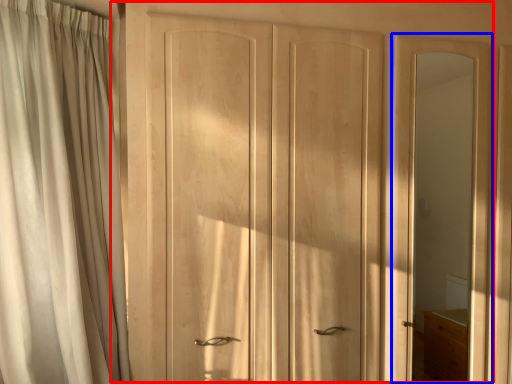
Question: Among these objects, which one is farthest to the camera, door (highlighted by a red box) or screen door (highlighted by a blue box)?

Choices:
 (A) door
 (B) screen door

Answer: (B)